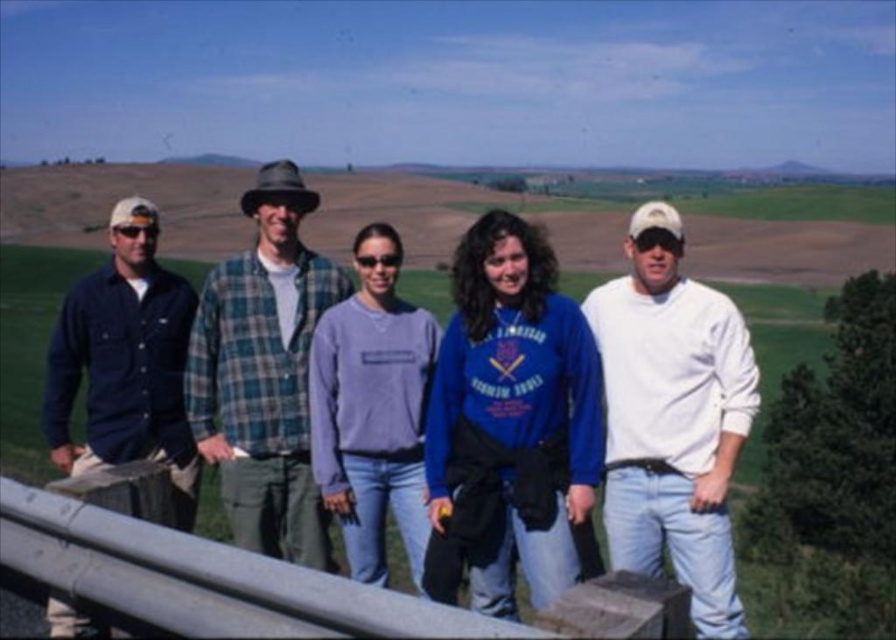
Question: Which object is positioned farthest from the purple fleece sweater at center?

Choices:
 (A) metallic gray rail at center
 (B) white cotton shirt at center

Answer: (A)

Question: Is blue fleece jacket at center further to camera compared to metallic gray rail at center?

Choices:
 (A) no
 (B) yes

Answer: (B)

Question: Which object appears farthest from the camera in this image?

Choices:
 (A) purple fleece sweater at center
 (B) dark blue flannel shirt at left

Answer: (A)

Question: Among these objects, which one is nearest to the camera?

Choices:
 (A) dark blue flannel shirt at left
 (B) white cotton shirt at center

Answer: (B)

Question: Does dark blue flannel shirt at left appear on the right side of purple fleece sweater at center?

Choices:
 (A) yes
 (B) no

Answer: (B)

Question: Observing the image, what is the correct spatial positioning of green plaid shirt at center in reference to purple fleece sweater at center?

Choices:
 (A) left
 (B) right

Answer: (A)